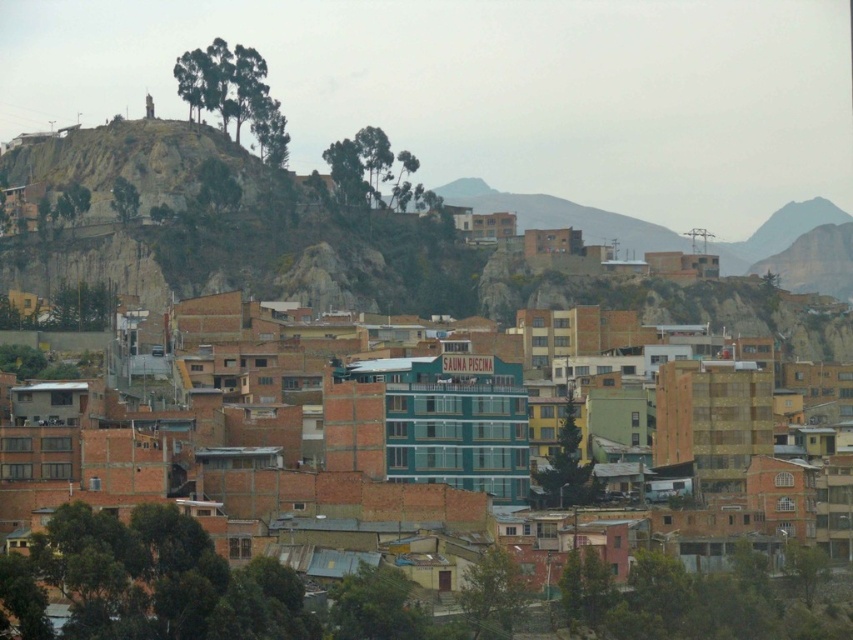
Who is lower down, brown brick buildings at center or rustic stone hill at upper left?

brown brick buildings at center is lower down.

Is brown brick buildings at center above rustic stone hill at upper left?

Incorrect, brown brick buildings at center is not positioned above rustic stone hill at upper left.

You are a GUI agent. You are given a task and a screenshot of the screen. Output one action in this format:
    pyautogui.click(x=<x>, y=<y>)
    Task: Click on the brown brick buildings at center
    Image resolution: width=853 pixels, height=640 pixels.
    Given the screenshot: What is the action you would take?
    pyautogui.click(x=219, y=588)